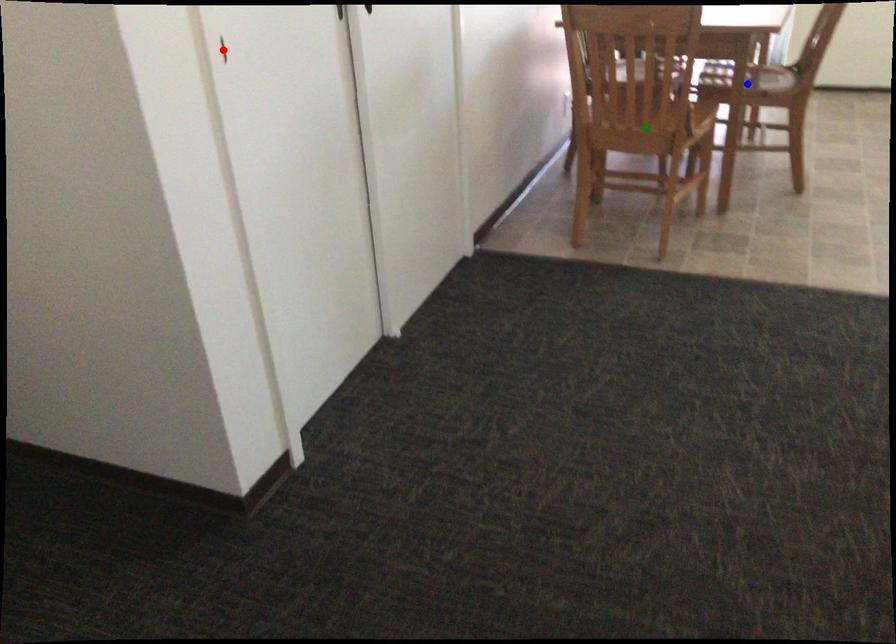
Order these from nearest to farthest:
- blue point
- red point
- green point

blue point → green point → red point